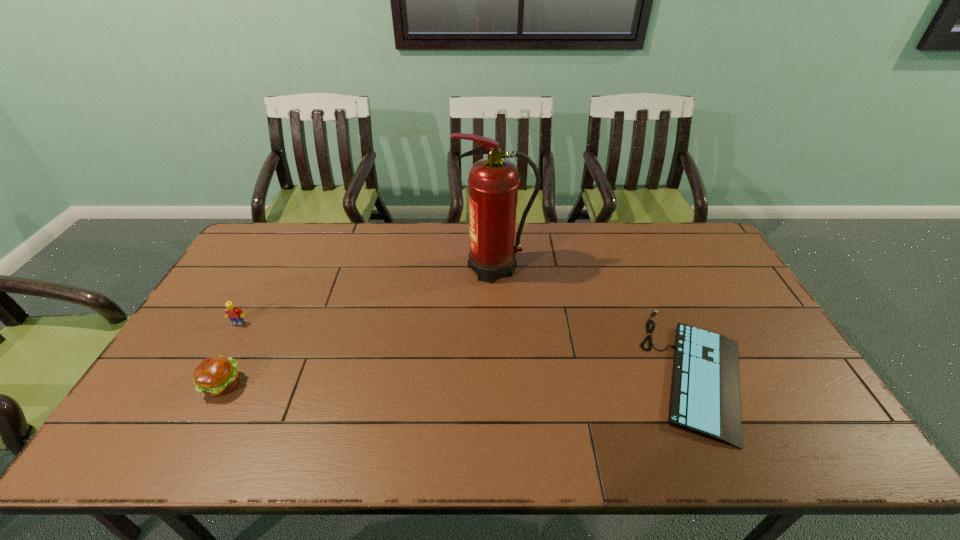
Locate an element on the screen. fire extinguisher is located at coordinates (493, 182).

I want to click on the farthest object, so click(493, 182).

Locate an element on the screen. This screenshot has width=960, height=540. Lego is located at coordinates (236, 315).

Locate an element on the screen. The image size is (960, 540). hamburger is located at coordinates (215, 376).

Where is `the shortest object`? the shortest object is located at coordinates (705, 392).

Where is `the rightmost object`? the rightmost object is located at coordinates (705, 392).

What are the coordinates of `vacant space situated on the front-facing side of the farthest object` in the screenshot? It's located at (426, 268).

At what (x,y) coordinates should I click in order to perform the action: click on free spot located on the front-facing side of the farthest object. Please return your answer as a coordinate pair (x, y). Looking at the image, I should click on (382, 268).

Locate an element on the screen. This screenshot has height=540, width=960. blank area located 0.340m on the front-facing side of the farthest object is located at coordinates (355, 268).

Where is `vacant area situated on the front-facing side of the Lego`? This screenshot has height=540, width=960. vacant area situated on the front-facing side of the Lego is located at coordinates (214, 368).